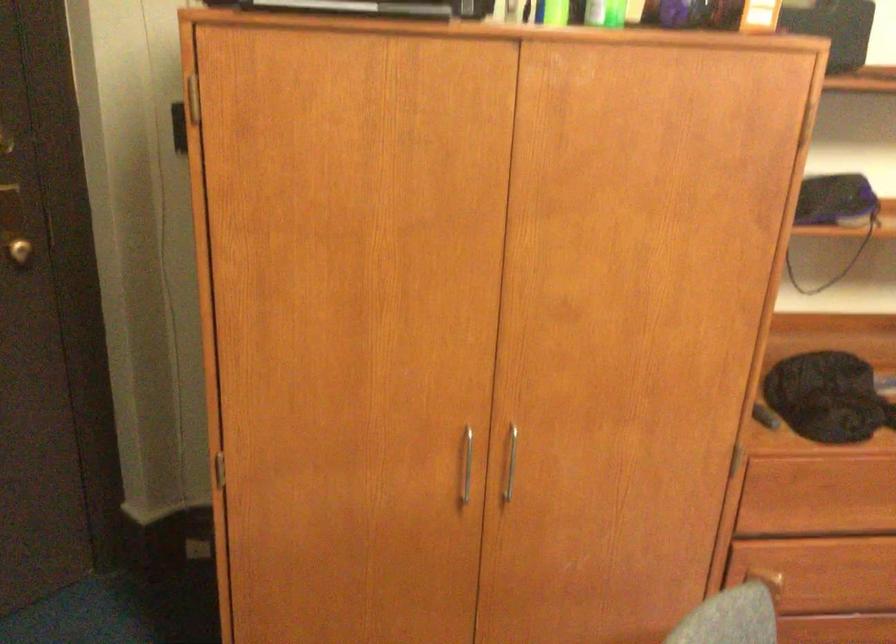
The width and height of the screenshot is (896, 644). What do you see at coordinates (20, 251) in the screenshot?
I see `a round door knob` at bounding box center [20, 251].